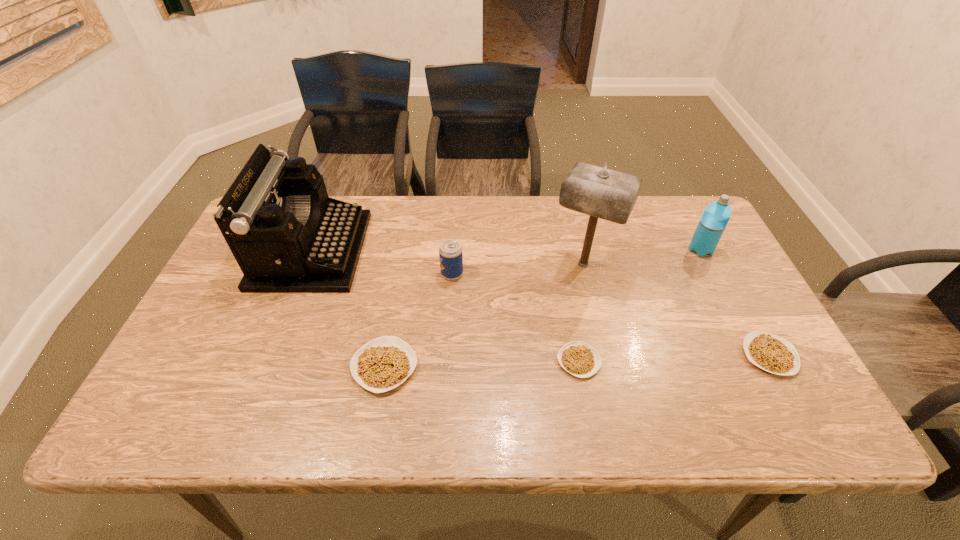
Where is `free space at the near right corner of the desktop`? This screenshot has height=540, width=960. free space at the near right corner of the desktop is located at coordinates (765, 375).

This screenshot has width=960, height=540. Find the location of `vacant space in between the tallest legume and the fourth shortest object`. vacant space in between the tallest legume and the fourth shortest object is located at coordinates 419,320.

This screenshot has height=540, width=960. I want to click on free area in between the fifth shortest object and the beer can, so click(x=576, y=262).

Locate an element on the screen. This screenshot has width=960, height=540. vacant region between the second shortest legume and the fifth object from right to left is located at coordinates (611, 315).

Find the location of a particular element. vacant space that's between the beer can and the second legume from right to left is located at coordinates (516, 318).

I want to click on free space between the beer can and the thermos bottle, so click(576, 262).

This screenshot has height=540, width=960. What are the coordinates of `empty space between the tallest legume and the second tallest object` in the screenshot? It's located at (348, 308).

Identify the location of empty location between the fourth tallest object and the tallest legume. (x=419, y=320).

Find the location of `vacant point located between the mallet and the thermos bottle`. vacant point located between the mallet and the thermos bottle is located at coordinates (642, 257).

This screenshot has height=540, width=960. Find the location of `vacant region between the mallet and the shortest legume`. vacant region between the mallet and the shortest legume is located at coordinates (581, 313).